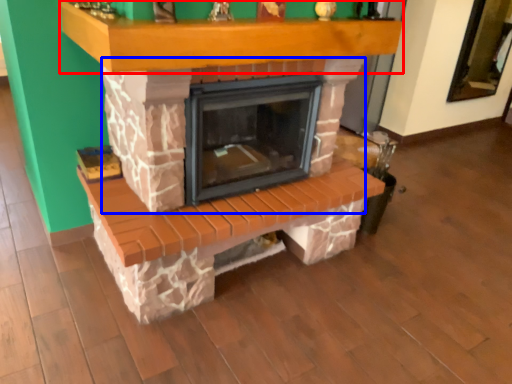
Question: Which object appears farthest to the camera in this image, mantle (highlighted by a red box) or fireplace (highlighted by a blue box)?

Choices:
 (A) mantle
 (B) fireplace

Answer: (B)